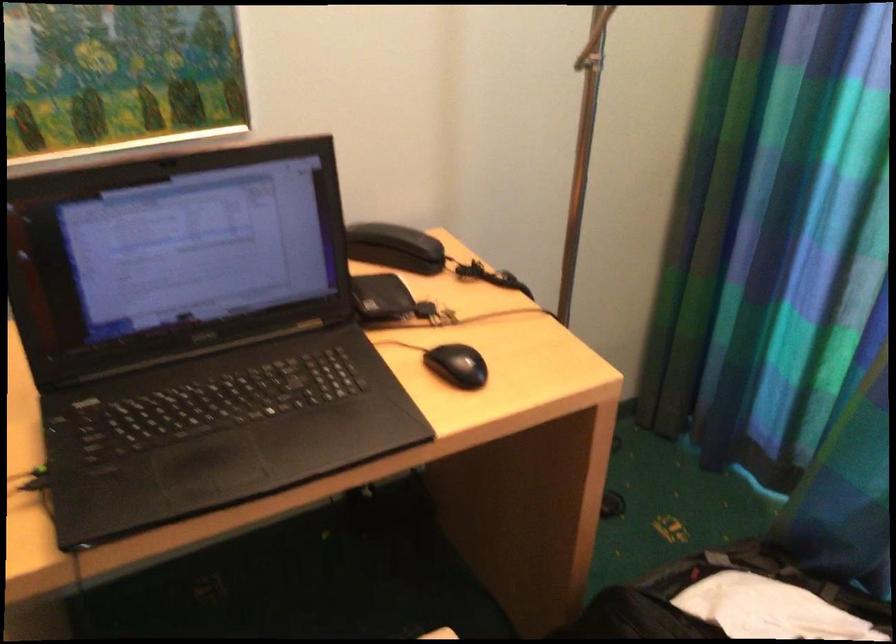
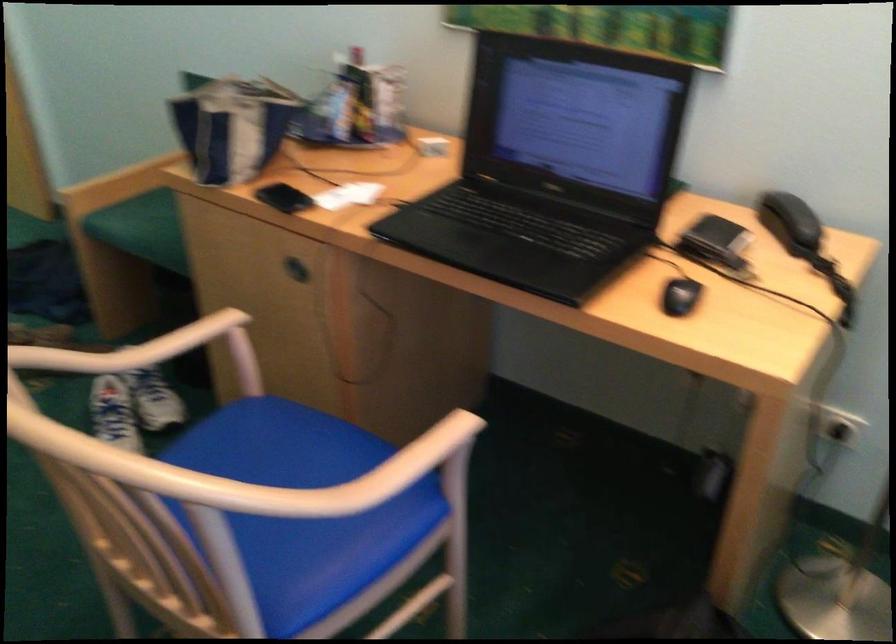
Question: The images are taken continuously from a first-person perspective. In which direction is your viewpoint rotating?

Choices:
 (A) Left
 (B) Right
 (C) Up
 (D) Down

Answer: (A)